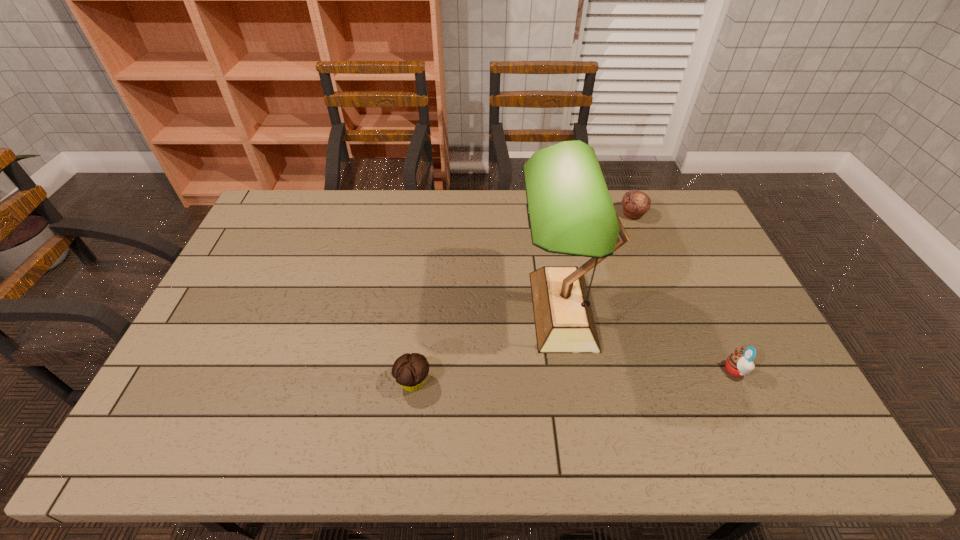
This screenshot has width=960, height=540. What are the coordinates of `the tallest object` in the screenshot? It's located at (570, 210).

The image size is (960, 540). I want to click on table lamp, so click(x=570, y=210).

Find the location of a particular element. This screenshot has height=540, width=960. the second muffin from left to right is located at coordinates (635, 203).

Identify the location of the farthest object. The image size is (960, 540). (635, 203).

Identify the location of the rightmost object. (738, 364).

Image resolution: width=960 pixels, height=540 pixels. I want to click on the leftmost muffin, so click(410, 370).

The image size is (960, 540). In order to click on free space located 0.260m on the metallic stand of the table lamp in this screenshot , I will do `click(429, 310)`.

You are a GUI agent. You are given a task and a screenshot of the screen. Output one action in this format:
    pyautogui.click(x=<x>, y=<y>)
    Task: Click on the free space located 0.150m on the metallic stand of the table lamp
    
    Given the screenshot: What is the action you would take?
    pyautogui.click(x=467, y=310)

Find the location of `free space located on the metallic stand of the table lamp`. free space located on the metallic stand of the table lamp is located at coordinates (473, 310).

Find the location of a particular element. Image resolution: width=960 pixels, height=540 pixels. free point located on the front of the farthest muffin is located at coordinates (655, 271).